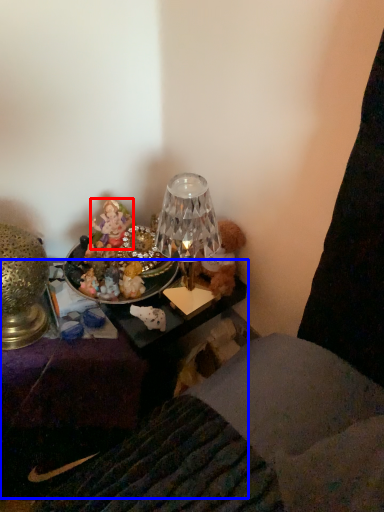
Question: Among these objects, which one is nearest to the camera, person (highlighted by a red box) or furniture (highlighted by a blue box)?

Choices:
 (A) person
 (B) furniture

Answer: (B)